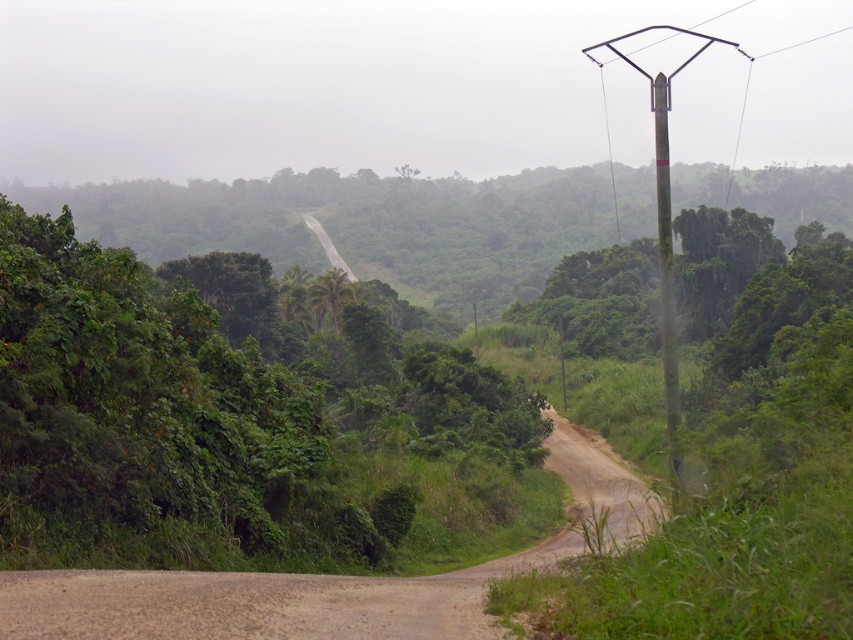
You are driving a car and want to take a photo of the green textured pole at right without the green leafy tree at center blocking it. Which direction should you move your car to get a clear view?

You should move your car to the left to get a clear view of the green textured pole at right without the green leafy tree at center blocking it, since the green textured pole at right is behind the green leafy tree at center.

Consider the image. You are standing at the edge of the dirt road and want to walk to the tree. Which direction should you face to walk directly towards the green leafy tree at center from the brown dirt track at center?

You should face to the left since the green leafy tree at center is positioned to the left of the brown dirt track at center.

You are a hiker trying to navigate through the rural landscape. You see the brown dirt track at center and the green textured pole at right. Which path should you follow if you want to choose the narrower route?

The brown dirt track at center is smaller than the green textured pole at right, so you should follow the brown dirt track at center for the narrower route.